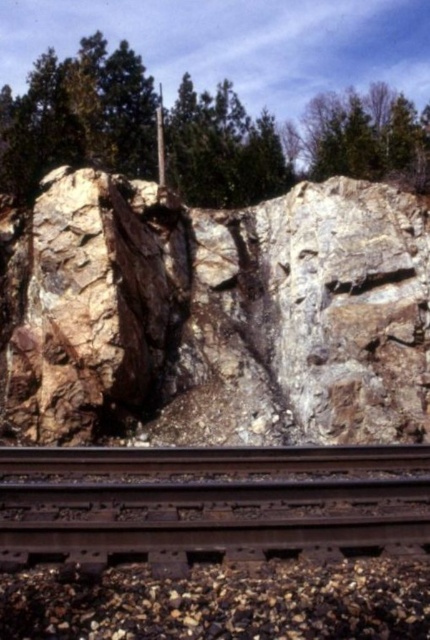
You are a hiker trying to cross this rocky area. You see the brown rusted metal train track at bottom and the green rough tree at upper center. Which one is closer to you?

The brown rusted metal train track at bottom is closer to you since it is located at the bottom of the image, which typically represents the foreground in such scenes, whereas the green rough tree at upper center is positioned higher up, suggesting it is farther away.

You are a hiker navigating the rugged, rocky landscape shown in the image. You see a green rough tree at upper center. Can you determine its exact position in the scene?

The green rough tree at upper center is located at point (288, 148).